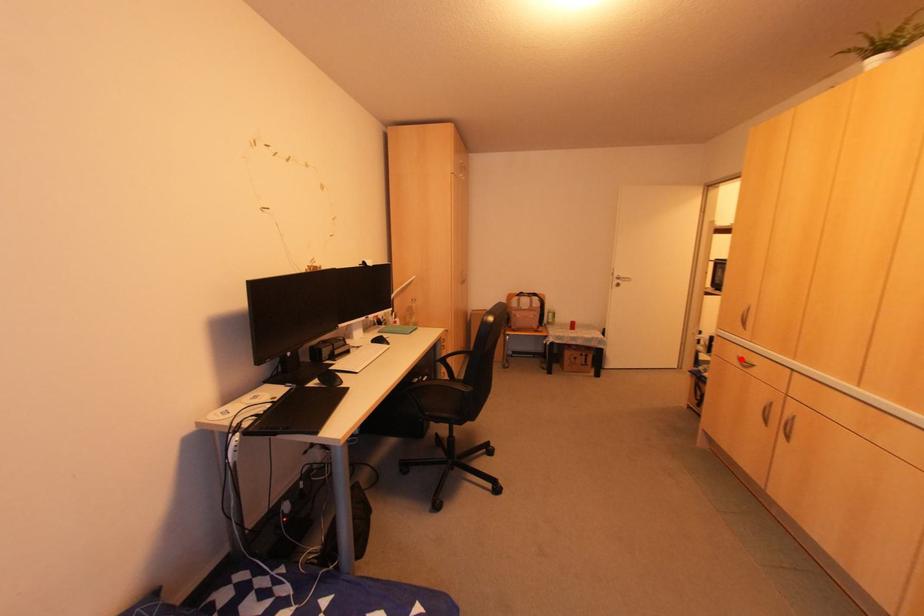
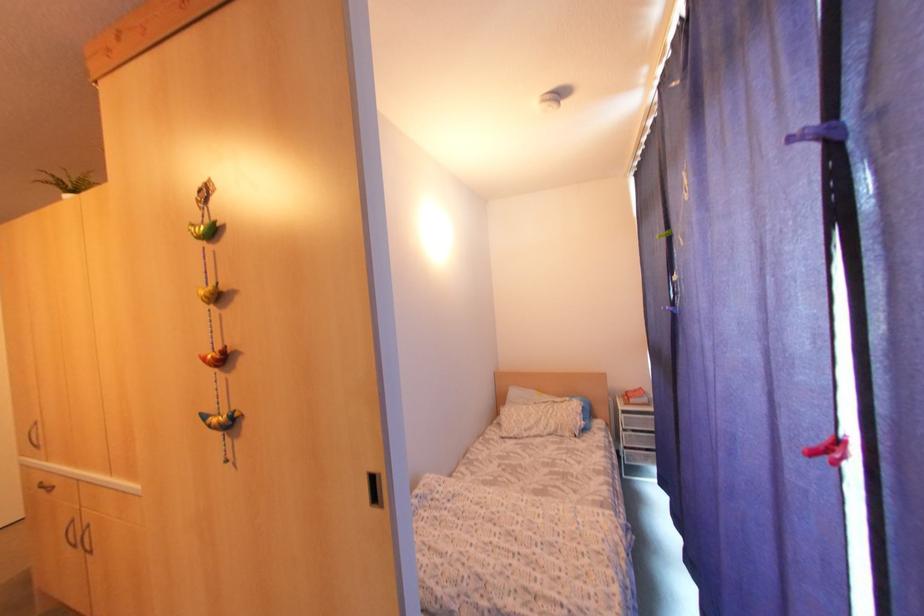
The point at the highlighted location is marked in the first image. Where is the corresponding point in the second image?

(45, 483)